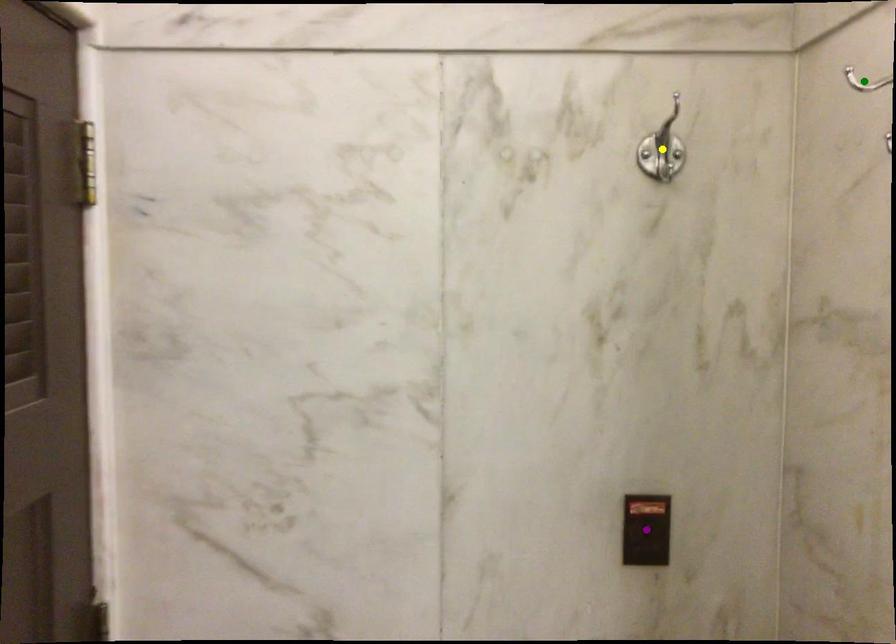
Order these from nearest to farthest:
- green point
- purple point
- yellow point

purple point
yellow point
green point